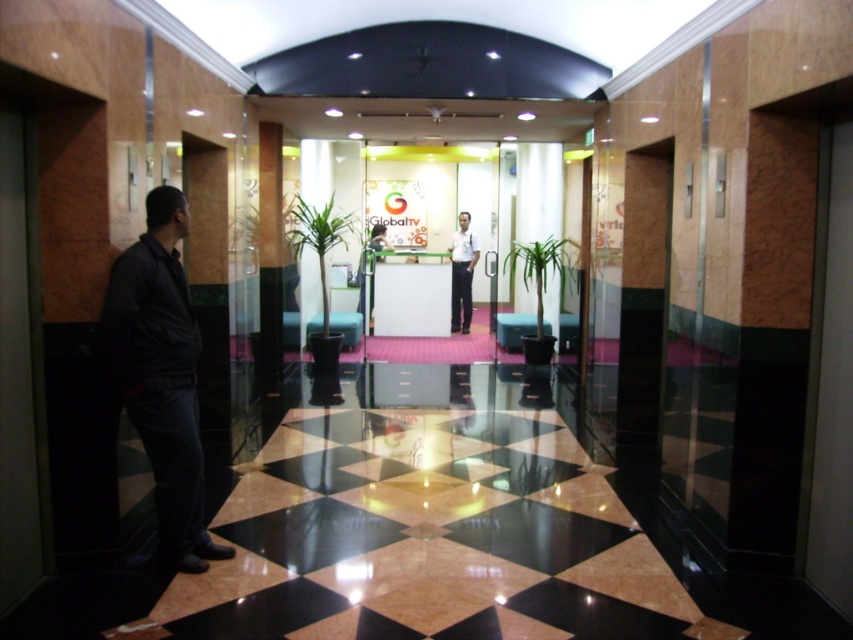
Question: Estimate the real-world distances between objects in this image. Which object is farther from the white shirt at center?

Choices:
 (A) dark gray jacket at left
 (B) matte black shirt at center

Answer: (A)

Question: Estimate the real-world distances between objects in this image. Which object is farther from the dark gray jacket at left?

Choices:
 (A) white shirt at center
 (B) matte black shirt at center

Answer: (A)

Question: Does dark gray jacket at left appear under white shirt at center?

Choices:
 (A) yes
 (B) no

Answer: (A)

Question: Which of the following is the farthest from the observer?

Choices:
 (A) (457, 268)
 (B) (370, 273)

Answer: (A)

Question: Is dark gray jacket at left to the right of white shirt at center from the viewer's perspective?

Choices:
 (A) yes
 (B) no

Answer: (B)

Question: Is white shirt at center positioned behind matte black shirt at center?

Choices:
 (A) yes
 (B) no

Answer: (A)